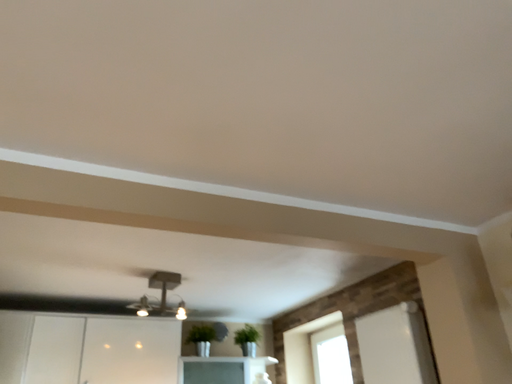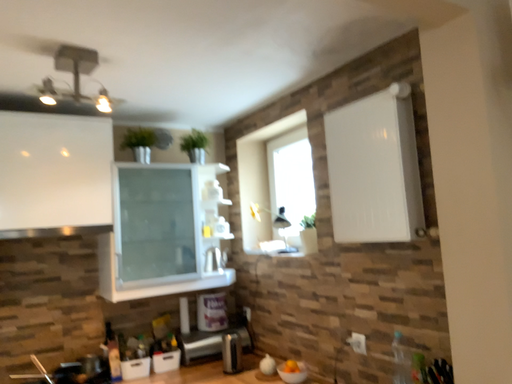
Question: How did the camera likely rotate when shooting the video?

Choices:
 (A) rotated upward
 (B) rotated downward

Answer: (B)